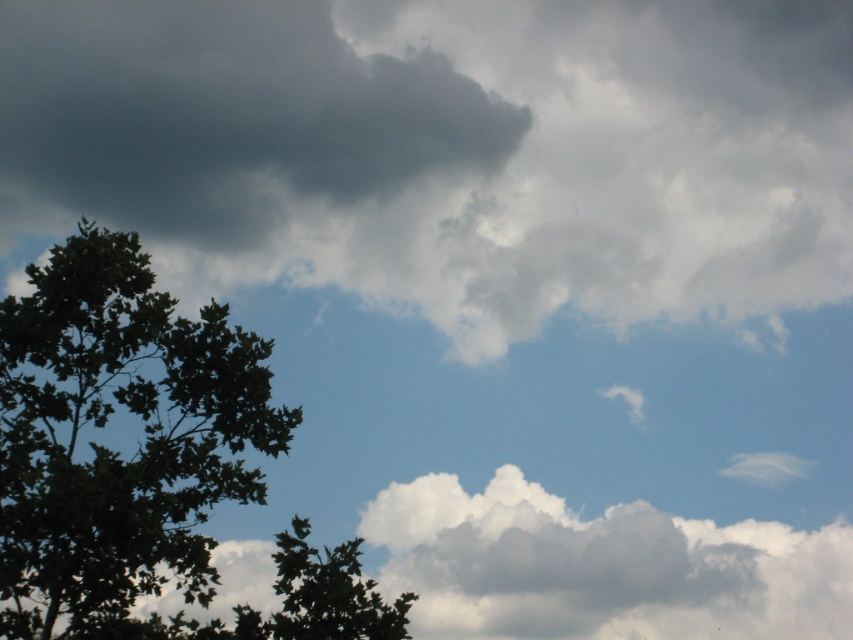
You are an airplane pilot preparing to fly through the clouds in this scene. You need to determine if the white fluffy cloud at center is taller than the green leafy tree at upper left. Based on the scene, what can you conclude?

The white fluffy cloud at center is much taller than the green leafy tree at upper left, so yes, it is taller.

You are an airplane pilot preparing to navigate through the clouds. You see the dark gray fluffy cloud at upper left and the white fluffy cloud at center. Which cloud is positioned more to the left side of the sky?

The dark gray fluffy cloud at upper left is positioned more to the left side of the sky than the white fluffy cloud at center.

Consider the image. You are an artist painting the sky scene. You need to decide which object to paint first based on their sizes. According to the scene, which object should you paint first, the green leafy tree at left or the white fluffy cloud at center?

The green leafy tree at left is smaller than the white fluffy cloud at center, so you should paint the white fluffy cloud at center first as it is larger and might require more attention in the composition.